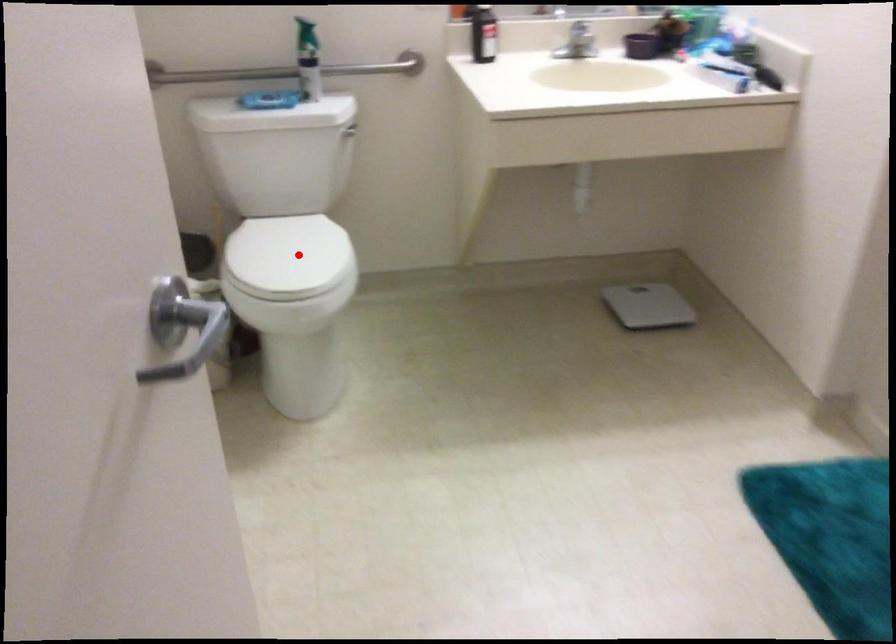
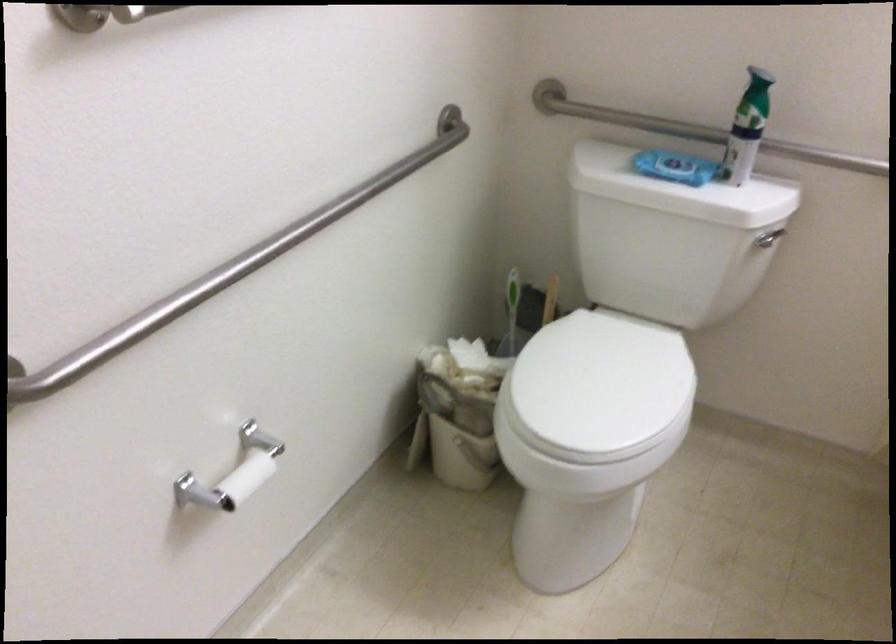
Where in the second image is the point corresponding to the highlighted location from the first image?

(600, 384)